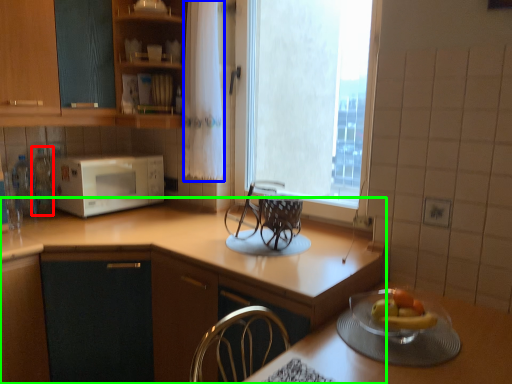
Question: Considering the real-world distances, which object is closest to bottle (highlighted by a red box)? curtain (highlighted by a blue box) or countertop (highlighted by a green box).

Choices:
 (A) curtain
 (B) countertop

Answer: (A)